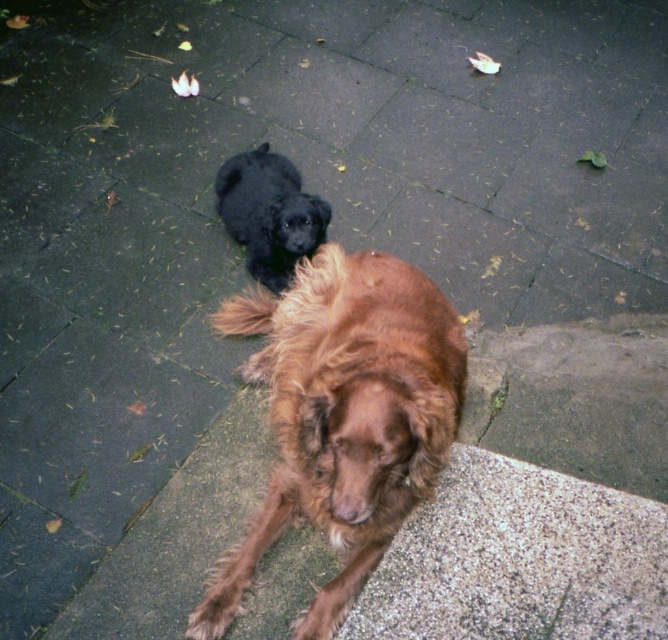
Between brown furry dog at center and shiny black fur at upper center, which one is positioned higher?

A: shiny black fur at upper center is above.

Does brown furry dog at center have a lesser width compared to shiny black fur at upper center?

No, brown furry dog at center is not thinner than shiny black fur at upper center.

Image resolution: width=668 pixels, height=640 pixels. I want to click on brown furry dog at center, so click(x=343, y=417).

The height and width of the screenshot is (640, 668). What are the coordinates of `brown furry dog at center` in the screenshot? It's located at tap(343, 417).